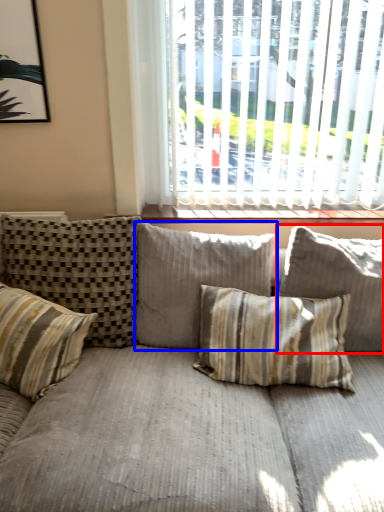
Question: Which object is closer to the camera taking this photo, pillow (highlighted by a red box) or pillow (highlighted by a blue box)?

Choices:
 (A) pillow
 (B) pillow

Answer: (A)